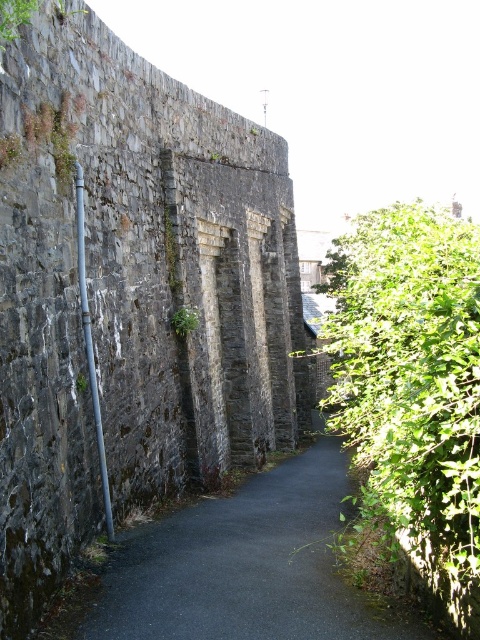
Question: Which of these objects is positioned closest to the black asphalt path at center?

Choices:
 (A) green leafy bush at right
 (B) dark stone wall at center

Answer: (B)

Question: Is green leafy bush at right above black asphalt path at center?

Choices:
 (A) yes
 (B) no

Answer: (A)

Question: Which of the following is the farthest from the observer?

Choices:
 (A) (326, 266)
 (B) (304, 605)

Answer: (A)

Question: Which of the following is the closest to the observer?

Choices:
 (A) (12, 125)
 (B) (297, 516)
 (C) (367, 440)

Answer: (A)

Question: Can you confirm if green leafy bush at right is smaller than black asphalt path at center?

Choices:
 (A) yes
 (B) no

Answer: (B)

Question: From the image, what is the correct spatial relationship of dark stone wall at center in relation to green leafy bush at right?

Choices:
 (A) above
 (B) below

Answer: (A)